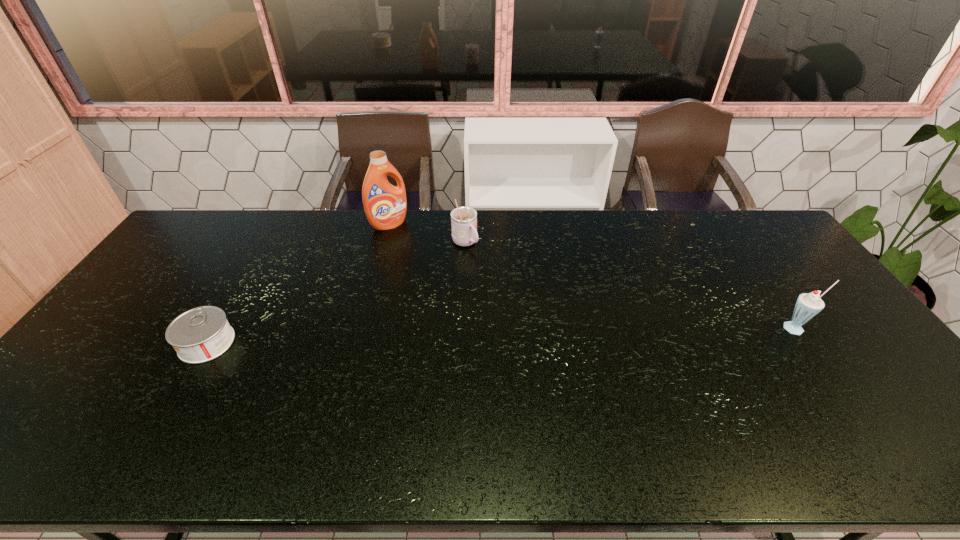
Locate an element on the screen. free space on the desktop that is between the can and the rightmost object and is positioned on the side with the handle of the second shortest object is located at coordinates (564, 334).

Where is `vacant space on the desktop that is between the leftmost object and the rightmost object and is positioned on the front-facing side of the second object from left to right`? This screenshot has height=540, width=960. vacant space on the desktop that is between the leftmost object and the rightmost object and is positioned on the front-facing side of the second object from left to right is located at coordinates (482, 336).